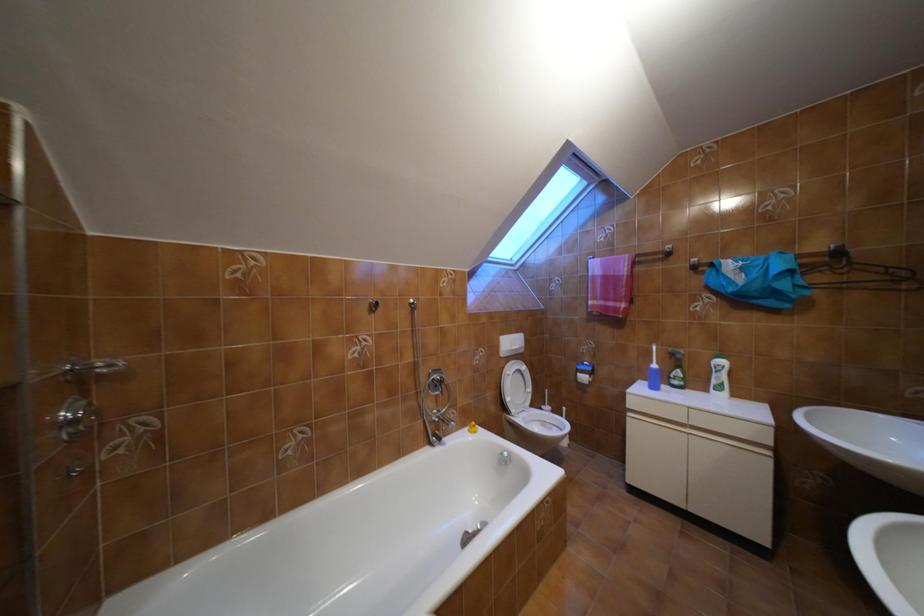
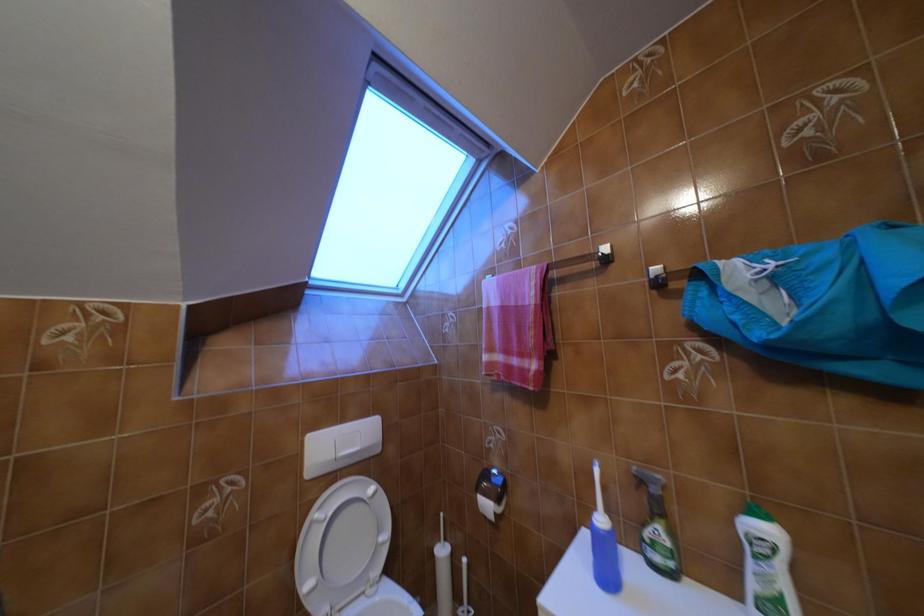
The images are taken continuously from a first-person perspective. In which direction are you moving?

The movement direction of the cameraman is right, forward.